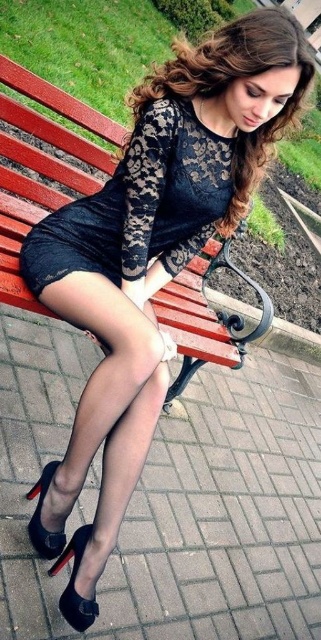
Does lace fabric dress at center have a greater height compared to wooden bench at center?

No.

Find the location of a particular element. This screenshot has height=640, width=321. lace fabric dress at center is located at coordinates pos(139,204).

Is point (164, 100) more distant than point (202, 340)?

No.

What are the coordinates of `lace fabric dress at center` in the screenshot? It's located at (139, 204).

Can you confirm if black sheer tights at lower center is thinner than lace fabric dress at center?

Yes.

Between point (63, 598) and point (131, 221), which one is positioned behind?

The point (131, 221) is more distant.

What are the coordinates of `black sheer tights at lower center` in the screenshot? It's located at (101, 428).

Who is higher up, black sheer tights at lower center or wooden bench at center?

Positioned higher is wooden bench at center.

Between black sheer tights at lower center and wooden bench at center, which one appears on the right side from the viewer's perspective?

From the viewer's perspective, wooden bench at center appears more on the right side.

Which is in front, point (115, 385) or point (62, 136)?

Point (115, 385)

You are a GUI agent. You are given a task and a screenshot of the screen. Output one action in this format:
    pyautogui.click(x=<x>, y=<y>)
    Task: Click on the black sheer tights at lower center
    
    Given the screenshot: What is the action you would take?
    pyautogui.click(x=101, y=428)